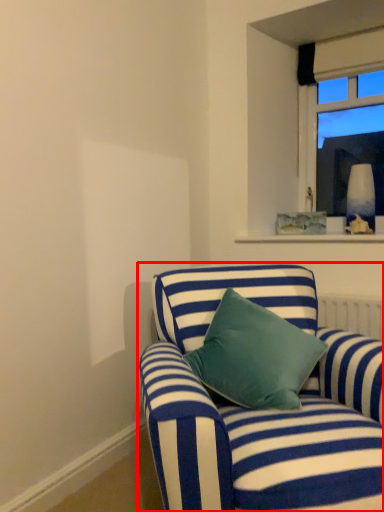
Question: From the image's perspective, what is the correct spatial relationship of studio couch (annotated by the red box) in relation to window?

Choices:
 (A) above
 (B) below

Answer: (B)